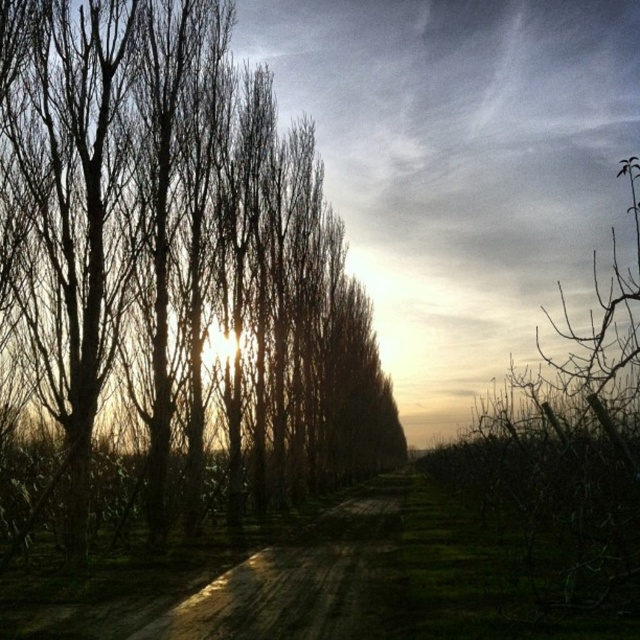
Does point (35, 33) come behind point (266, 540)?

No, it is not.

Is bare branches at center closer to the viewer compared to dull brown dirt track at center?

That is False.

The height and width of the screenshot is (640, 640). What do you see at coordinates (177, 268) in the screenshot? I see `bare branches at center` at bounding box center [177, 268].

The height and width of the screenshot is (640, 640). I want to click on bare branches at center, so click(177, 268).